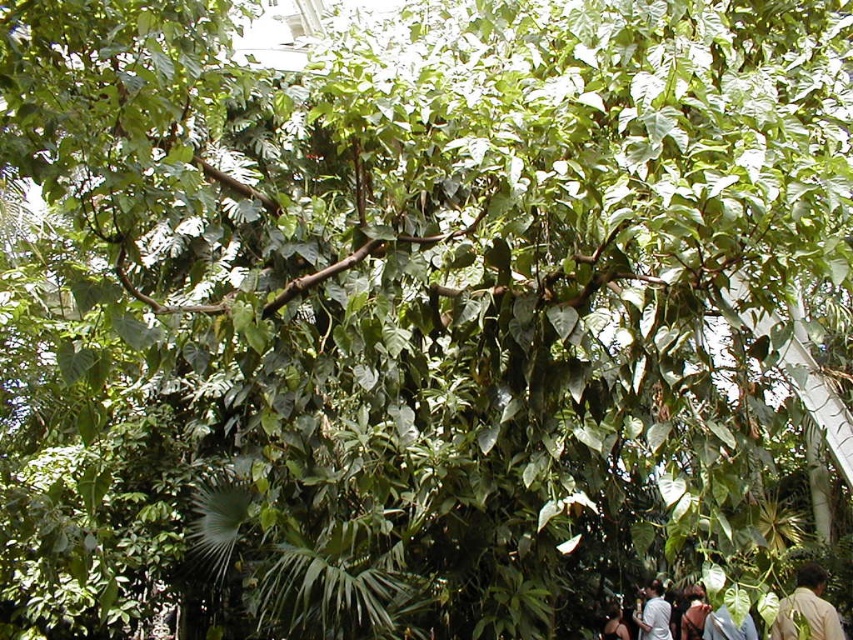
Question: Among these objects, which one is nearest to the camera?

Choices:
 (A) light brown skin at lower right
 (B) light brown leather jacket at lower center
 (C) white shirt at lower right

Answer: (A)

Question: Does light brown skin at lower right have a greater width compared to light brown leather jacket at lower center?

Choices:
 (A) no
 (B) yes

Answer: (B)

Question: Does light brown skin at lower right appear under light brown leather jacket at lower right?

Choices:
 (A) no
 (B) yes

Answer: (A)

Question: Where is light brown skin at lower right located in relation to light brown leather jacket at lower right in the image?

Choices:
 (A) above
 (B) below

Answer: (A)

Question: Based on their relative distances, which object is nearer to the white shirt at lower right?

Choices:
 (A) light brown leather jacket at lower center
 (B) light brown leather jacket at lower right
 (C) light brown skin at lower right

Answer: (B)

Question: Which point is closer to the camera taking this photo?

Choices:
 (A) (782, 609)
 (B) (660, 588)

Answer: (A)